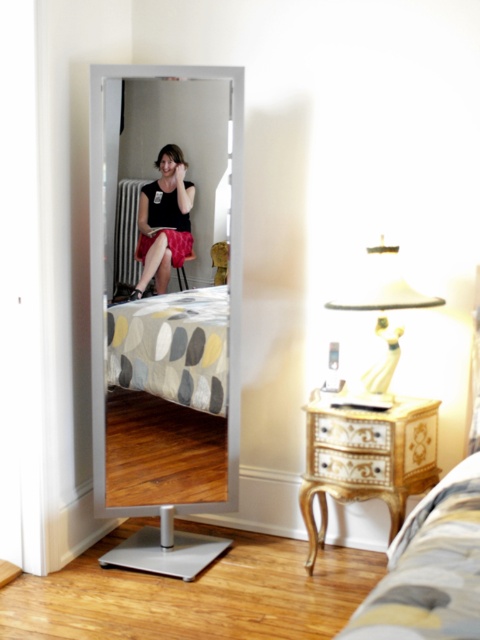
Describe the element at coordinates (367, 458) in the screenshot. This screenshot has height=640, width=480. I see `gold ornate dresser at lower right` at that location.

Does gold ornate dresser at lower right have a lesser height compared to matte pink fabric dress at center?

No.

The width and height of the screenshot is (480, 640). Find the location of `gold ornate dresser at lower right`. gold ornate dresser at lower right is located at coordinates (367, 458).

Is silver metallic mirror at center smaller than matte pink fabric dress at center?

Incorrect, silver metallic mirror at center is not smaller in size than matte pink fabric dress at center.

Which is behind, point (230, 500) or point (170, 195)?

Point (230, 500)

Who is more distant from viewer, (x=110, y=288) or (x=168, y=218)?

Point (x=168, y=218)

The image size is (480, 640). In order to click on silver metallic mirror at center in this screenshot , I will do `click(166, 291)`.

Who is positioned more to the left, silver metallic mirror at center or striped fabric bed at lower right?

silver metallic mirror at center is more to the left.

Is silver metallic mirror at center above striped fabric bed at lower right?

Yes.

The width and height of the screenshot is (480, 640). What do you see at coordinates (166, 291) in the screenshot? I see `silver metallic mirror at center` at bounding box center [166, 291].

Find the location of `silver metallic mirror at center`. silver metallic mirror at center is located at coordinates (166, 291).